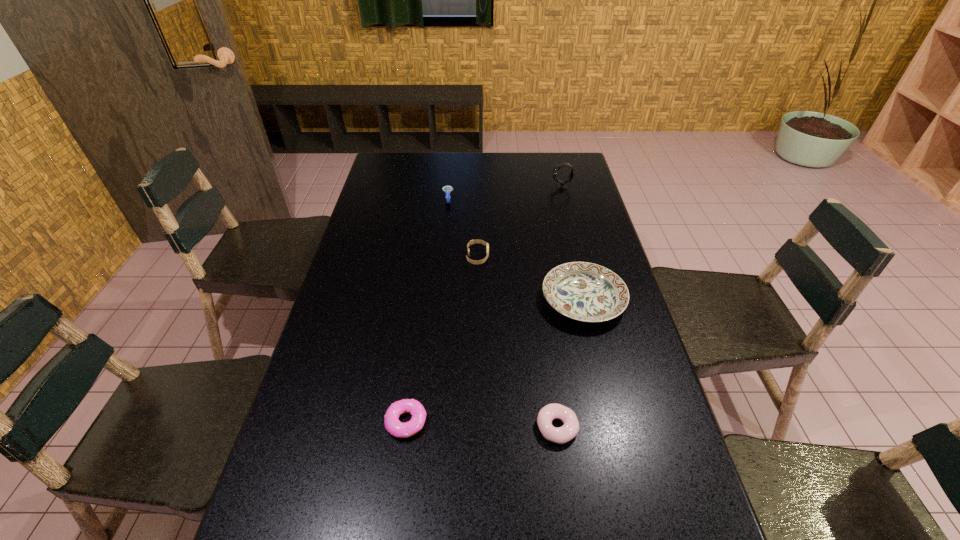
Identify the location of free space located on the face of the rightmost watch. The height and width of the screenshot is (540, 960). (494, 187).

The image size is (960, 540). In order to click on vacant space located 0.180m on the face of the rightmost watch in this screenshot , I will do `click(507, 187)`.

Locate an element on the screen. The width and height of the screenshot is (960, 540). vacant space positioned on the front of the second nearest watch is located at coordinates (444, 237).

What are the coordinates of `vacant area situated 0.150m on the face of the second watch from left to right` in the screenshot? It's located at (535, 257).

The width and height of the screenshot is (960, 540). Find the location of `vacant region located on the back of the plate`. vacant region located on the back of the plate is located at coordinates point(563,212).

Locate an element on the screen. vacant space located 0.110m on the left of the right doughnut is located at coordinates (489, 428).

The width and height of the screenshot is (960, 540). What are the coordinates of `vacant space positioned 0.090m on the front of the left doughnut` in the screenshot? It's located at (398, 482).

At what (x,y) coordinates should I click in order to perform the action: click on watch that is at the right edge. Please return your answer as a coordinate pair (x, y). The height and width of the screenshot is (540, 960). Looking at the image, I should click on (561, 184).

Identify the location of plate at the right edge. (587, 292).

Where is `free space at the far edge`? free space at the far edge is located at coordinates (498, 158).